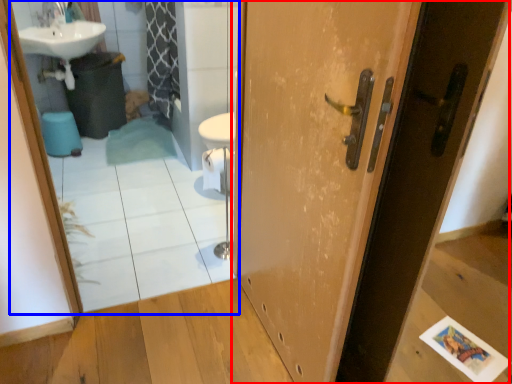
Question: Among these objects, which one is nearest to the camera, door (highlighted by a red box) or mirror (highlighted by a blue box)?

Choices:
 (A) door
 (B) mirror

Answer: (A)